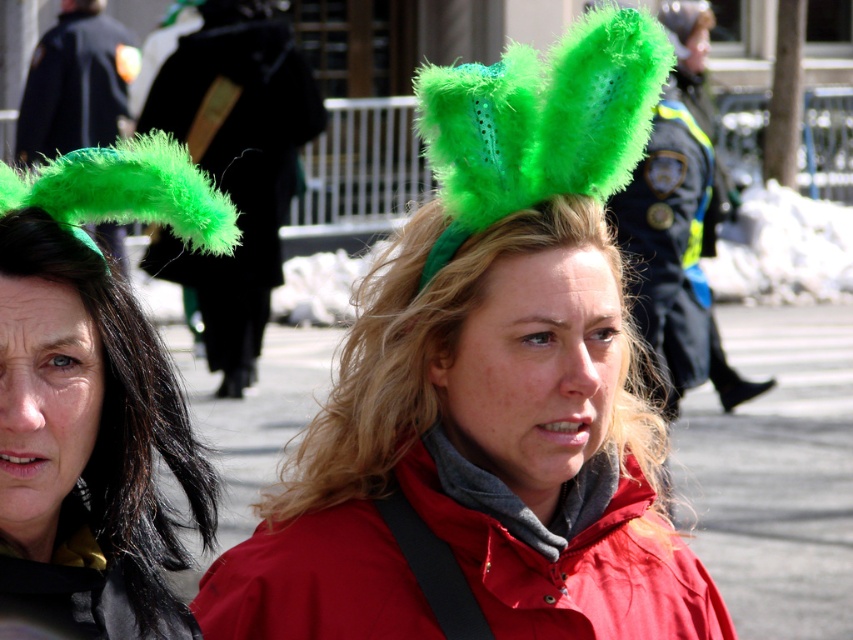
Where is `fuzzy green headband at center`? fuzzy green headband at center is located at coordinates (477, 456).

Who is lower down, fuzzy green headband at center or dark blue uniform at center?

fuzzy green headband at center is below.

The image size is (853, 640). What do you see at coordinates (477, 456) in the screenshot?
I see `fuzzy green headband at center` at bounding box center [477, 456].

The image size is (853, 640). Identify the location of fuzzy green headband at center. (477, 456).

Can you confirm if green fuzzy jacket at left is positioned to the right of dark blue uniform at center?

No, green fuzzy jacket at left is not to the right of dark blue uniform at center.

Does green fuzzy jacket at left appear under dark blue uniform at center?

Actually, green fuzzy jacket at left is above dark blue uniform at center.

Identify the location of green fuzzy jacket at left. (235, 134).

I want to click on green fuzzy jacket at left, so coord(235,134).

Can you confirm if matte red jacket at center is taller than black fabric jacket at upper left?

No, matte red jacket at center is not taller than black fabric jacket at upper left.

What do you see at coordinates (579, 570) in the screenshot? The height and width of the screenshot is (640, 853). I see `matte red jacket at center` at bounding box center [579, 570].

What do you see at coordinates (579, 570) in the screenshot?
I see `matte red jacket at center` at bounding box center [579, 570].

Where is `matte red jacket at center`? The image size is (853, 640). matte red jacket at center is located at coordinates (579, 570).